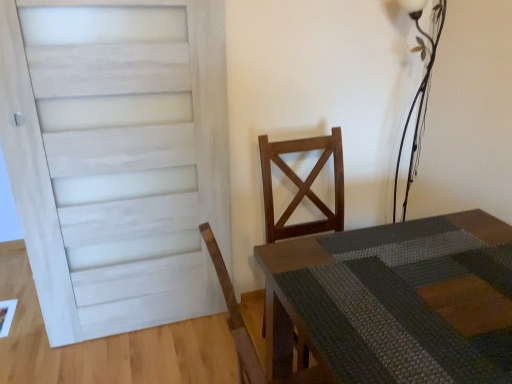
Identify the location of vacant region above rustic wood table at center (from a real-world perspective). (415, 279).